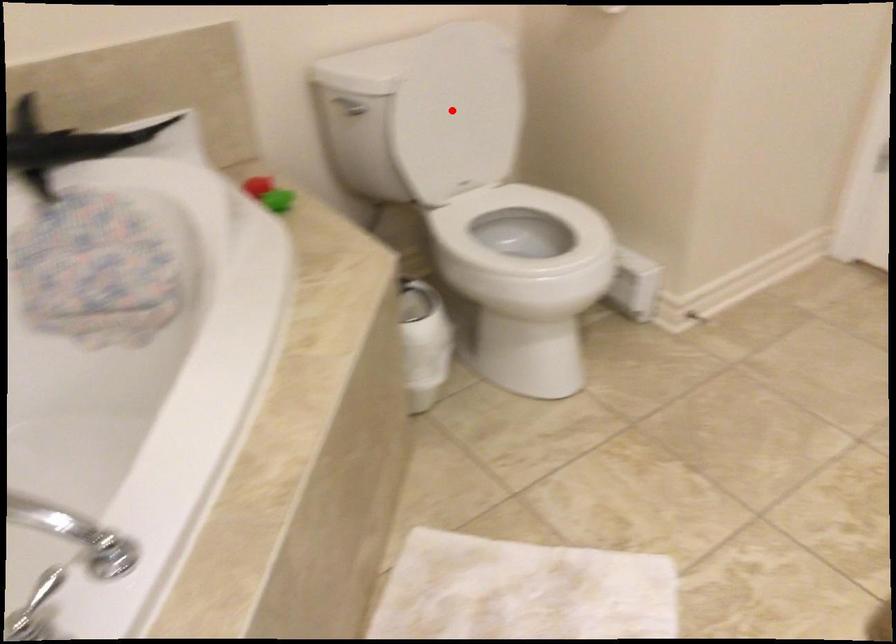
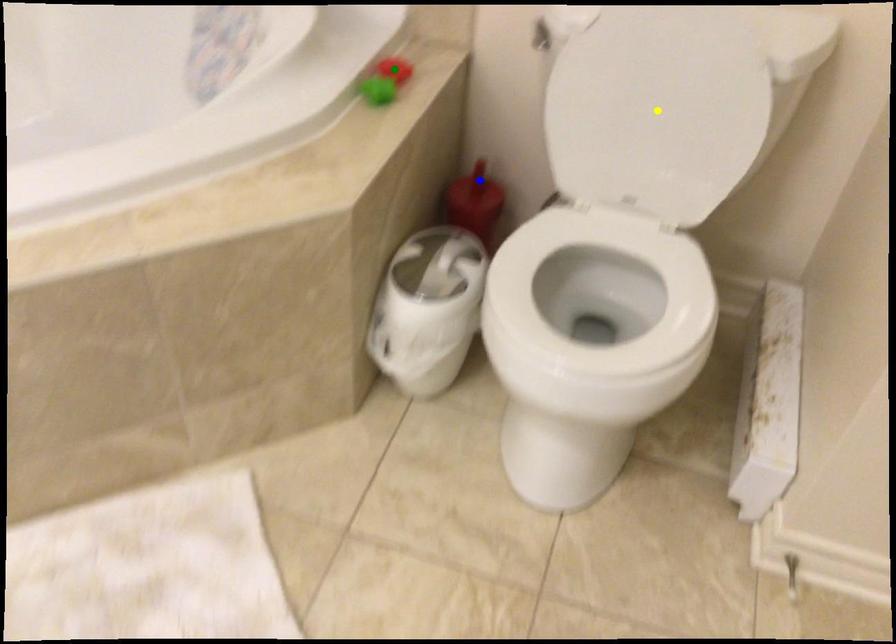
Question: I am providing you with two images of the same scene from different viewpoints. A red point is marked on the first image. You are given multiple points on the second image. Which point in image 2 represents the same 3d spot as the red point in image 1?

Choices:
 (A) green point
 (B) blue point
 (C) yellow point

Answer: (C)